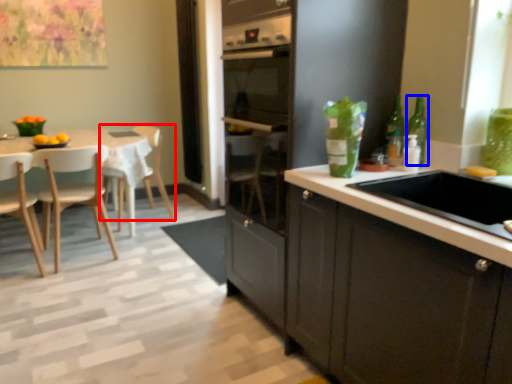
Question: Among these objects, which one is nearest to the camera, chair (highlighted by a red box) or bottle (highlighted by a blue box)?

Choices:
 (A) chair
 (B) bottle

Answer: (B)